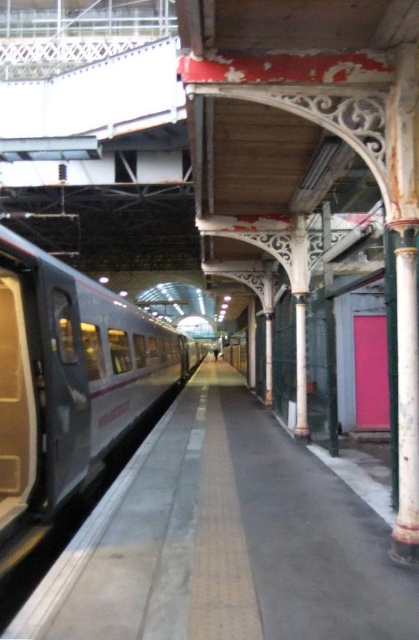
Question: Which point appears closest to the camera in this image?

Choices:
 (A) (59, 307)
 (B) (173, 506)

Answer: (A)

Question: Which point is farther from the camera taking this photo?

Choices:
 (A) (33, 337)
 (B) (222, 531)

Answer: (B)

Question: Does smooth gray platform at center have a smaller size compared to silver metallic train at left?

Choices:
 (A) yes
 (B) no

Answer: (A)

Question: Does smooth gray platform at center appear over silver metallic train at left?

Choices:
 (A) yes
 (B) no

Answer: (B)

Question: Does smooth gray platform at center have a lesser width compared to silver metallic train at left?

Choices:
 (A) no
 (B) yes

Answer: (A)